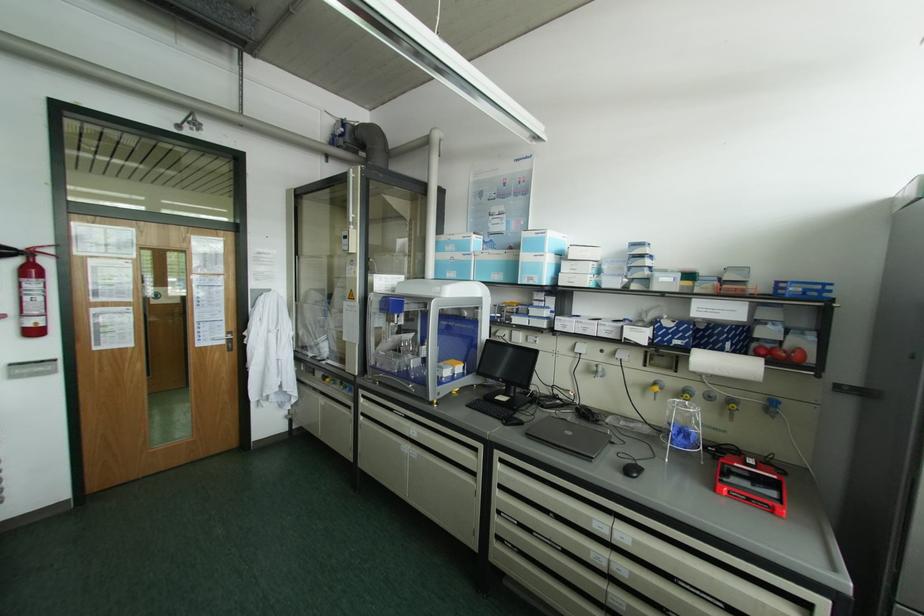
The width and height of the screenshot is (924, 616). Identify the location of red tomato. (796, 355).